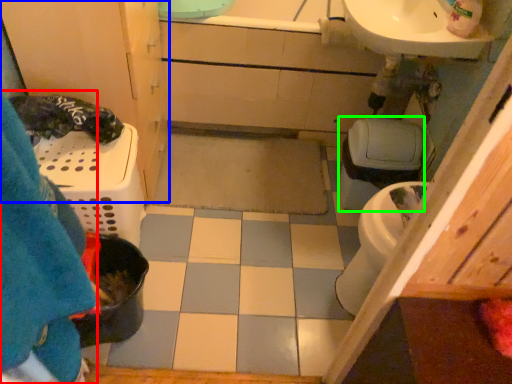
Question: Estimate the real-world distances between objects in this image. Which object is farther from blanket (highlighted by a red box), bathroom cabinet (highlighted by a blue box) or toilet bowl (highlighted by a green box)?

Choices:
 (A) bathroom cabinet
 (B) toilet bowl

Answer: (B)